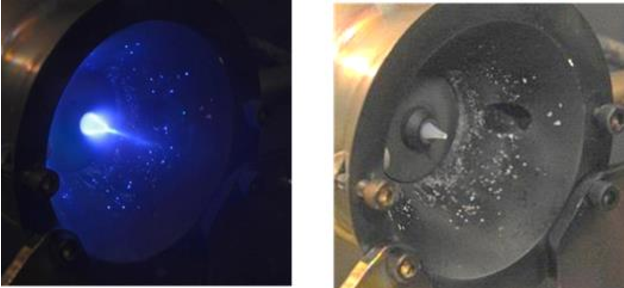
Identify the location of light. (363, 62).